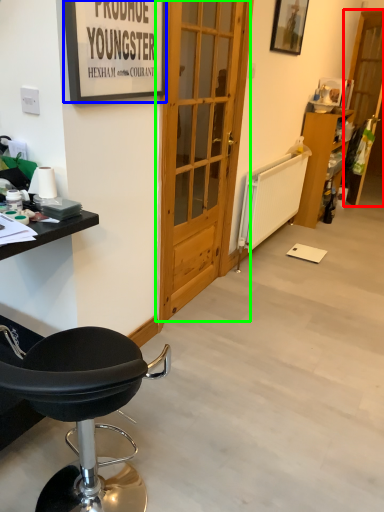
Question: Which object is positioned farthest from screen door (highlighted by a red box)? Select from picture frame (highlighted by a blue box) and door (highlighted by a green box).

Choices:
 (A) picture frame
 (B) door

Answer: (A)